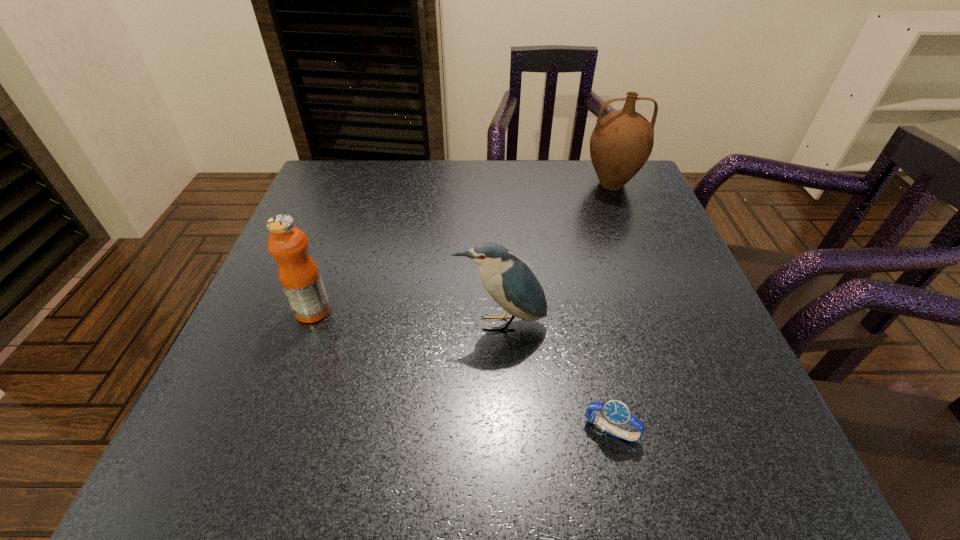
Where is `pitcher`? pitcher is located at coordinates (622, 141).

Locate an element on the screen. the farthest object is located at coordinates (622, 141).

Locate an element on the screen. The height and width of the screenshot is (540, 960). the leftmost object is located at coordinates (298, 273).

I want to click on bird, so click(509, 281).

Identify the location of watch. (616, 413).

Where is `the nearest object`? the nearest object is located at coordinates (616, 413).

Where is `vacant space located on the left of the farthest object`? The height and width of the screenshot is (540, 960). vacant space located on the left of the farthest object is located at coordinates (527, 184).

The height and width of the screenshot is (540, 960). I want to click on vacant area located on the right of the fruit juice, so click(382, 310).

You are a GUI agent. You are given a task and a screenshot of the screen. Output one action in this format:
    pyautogui.click(x=<x>, y=<y>)
    Task: Click on the vacant area situated 0.110m at the tip of the second object from left to right's beak
    
    Given the screenshot: What is the action you would take?
    pyautogui.click(x=503, y=391)

At what (x,y) coordinates should I click in order to perform the action: click on free location located on the left of the third object from left to right. Please return your answer as a coordinate pair (x, y). The height and width of the screenshot is (540, 960). Looking at the image, I should click on (427, 430).